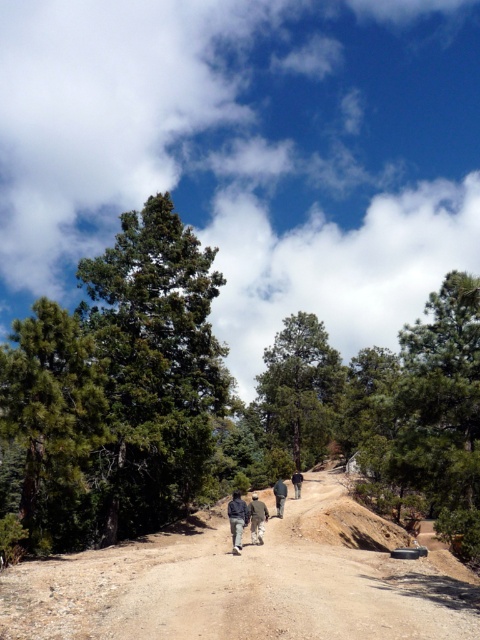
Question: Does green matte tree at right have a greater width compared to dark gray jacket at center?

Choices:
 (A) yes
 (B) no

Answer: (A)

Question: Estimate the real-world distances between objects in this image. Which object is farther from the dark gray sweater at center?

Choices:
 (A) light gray fabric pants at center
 (B) green matte tree at right
 (C) dark brown leather jacket at center

Answer: (B)

Question: Which point is closer to the camera taking this photo?

Choices:
 (A) [275, 355]
 (B) [300, 474]
 (C) [181, 330]

Answer: (C)

Question: Estimate the real-world distances between objects in this image. Which object is farther from the dark brown leather jacket at center?

Choices:
 (A) green matte tree at right
 (B) light gray fabric pants at center
 (C) dark gray sweater at center

Answer: (B)

Question: Considering the relative positions of dark gray sweater at center and light gray fabric pants at center in the image provided, where is dark gray sweater at center located with respect to light gray fabric pants at center?

Choices:
 (A) below
 (B) above

Answer: (A)

Question: Does green textured tree at center have a greater width compared to green matte tree at right?

Choices:
 (A) yes
 (B) no

Answer: (A)